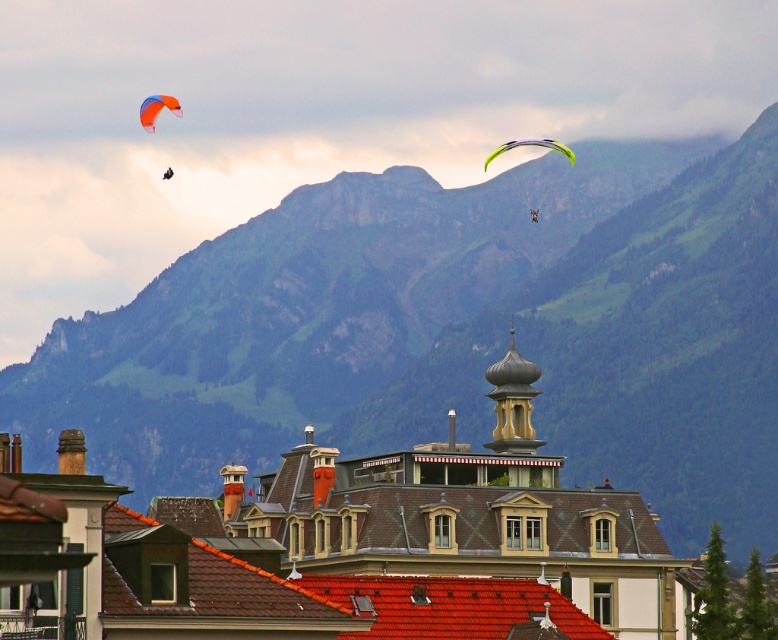
Question: Is green grassy mountain at upper center to the left of brown tiled roof at center from the viewer's perspective?

Choices:
 (A) yes
 (B) no

Answer: (B)

Question: Among these objects, which one is farthest from the camera?

Choices:
 (A) orange fabric parachute at upper left
 (B) green grassy mountain at upper center
 (C) orange fabric parasail at upper left

Answer: (C)

Question: Can you confirm if orange fabric parasail at upper left is positioned to the right of green translucent parachute at upper right?

Choices:
 (A) yes
 (B) no

Answer: (B)

Question: Does brown tiled roof at center have a lesser width compared to green translucent parachute at upper right?

Choices:
 (A) yes
 (B) no

Answer: (B)

Question: Which of these objects is positioned farthest from the green translucent parachute at upper right?

Choices:
 (A) orange fabric parasail at upper left
 (B) green grassy mountain at upper center
 (C) orange fabric parachute at upper left
 (D) brown tiled roof at center

Answer: (D)

Question: Among these objects, which one is nearest to the camera?

Choices:
 (A) orange fabric parasail at upper left
 (B) brown tiled roof at center

Answer: (B)